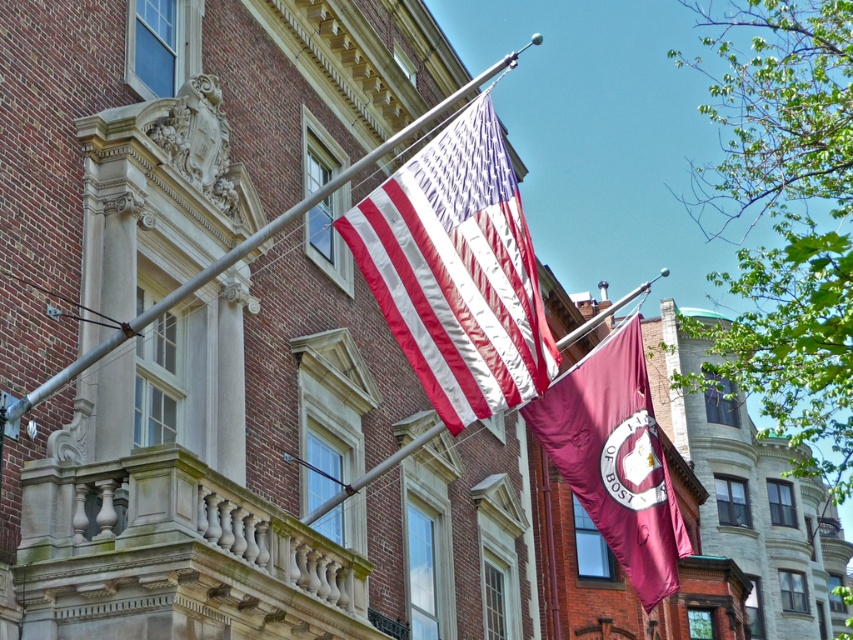
Does matte fabric flag at center have a lesser height compared to maroon fabric flag at center?

Correct, matte fabric flag at center is not as tall as maroon fabric flag at center.

Which is below, matte fabric flag at center or maroon fabric flag at center?

Result: maroon fabric flag at center is lower down.

At what (x,y) coordinates should I click in order to perform the action: click on matte fabric flag at center. Please return your answer as a coordinate pair (x, y). The height and width of the screenshot is (640, 853). Looking at the image, I should click on (457, 272).

How distant is matte fabric flag at center from metallic pole at upper center?

They are 221.90 feet apart.

Is matte fabric flag at center positioned at the back of metallic pole at upper center?

Yes, matte fabric flag at center is behind metallic pole at upper center.

Is point (403, 195) behind point (337, 177)?

No, (403, 195) is closer to viewer.

Identify the location of matte fabric flag at center. The height and width of the screenshot is (640, 853). (457, 272).

Is maroon fabric flag at center to the right of metallic pole at upper center from the viewer's perspective?

Correct, you'll find maroon fabric flag at center to the right of metallic pole at upper center.

Is maroon fabric flag at center to the left of metallic pole at upper center from the viewer's perspective?

No, maroon fabric flag at center is not to the left of metallic pole at upper center.

Is point (579, 390) more distant than point (444, 106)?

That is True.

Identify the location of maroon fabric flag at center. (614, 458).